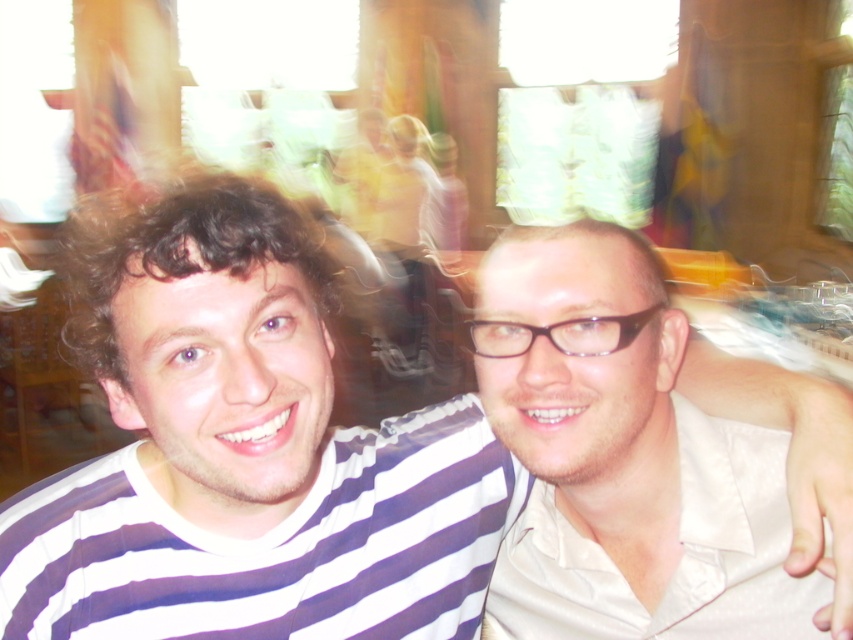
Question: Does white striped shirt at center have a greater width compared to matte white shirt at right?

Choices:
 (A) no
 (B) yes

Answer: (B)

Question: Which of the following is the farthest from the observer?

Choices:
 (A) (764, 451)
 (B) (28, 560)

Answer: (A)

Question: Can you confirm if white striped shirt at center is thinner than matte white shirt at right?

Choices:
 (A) no
 (B) yes

Answer: (A)

Question: Is white striped shirt at center bigger than matte white shirt at right?

Choices:
 (A) yes
 (B) no

Answer: (A)

Question: Which point appears farthest from the camera in this image?

Choices:
 (A) (167, 440)
 (B) (642, 337)

Answer: (B)